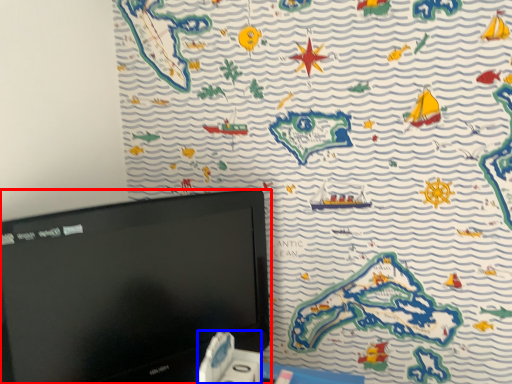
Question: Which of the following is the closest to the observer, computer monitor (highlighted by a red box) or game controller (highlighted by a blue box)?

Choices:
 (A) computer monitor
 (B) game controller

Answer: (A)